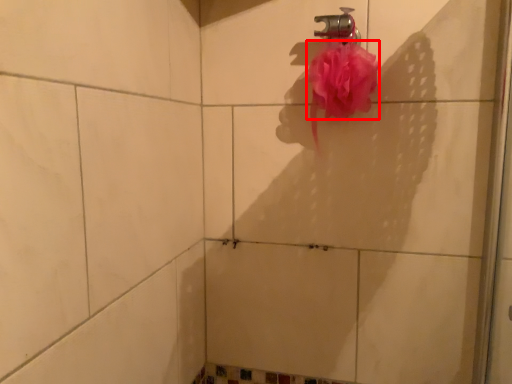
Question: From the image's perspective, what is the correct spatial relationship of blood (annotated by the red box) in relation to plumbing fixture?

Choices:
 (A) above
 (B) below

Answer: (B)